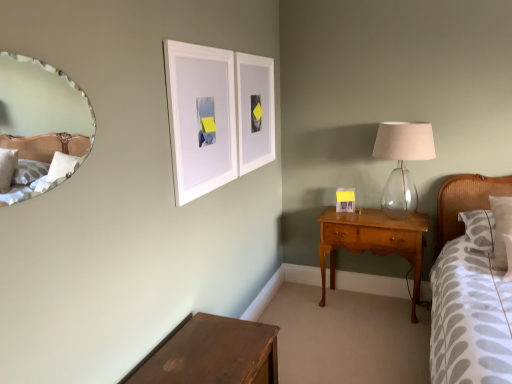
Locate an element on the screen. Image resolution: width=512 pixels, height=384 pixels. unoccupied area in front of light brown wood nightstand at center right is located at coordinates (375, 338).